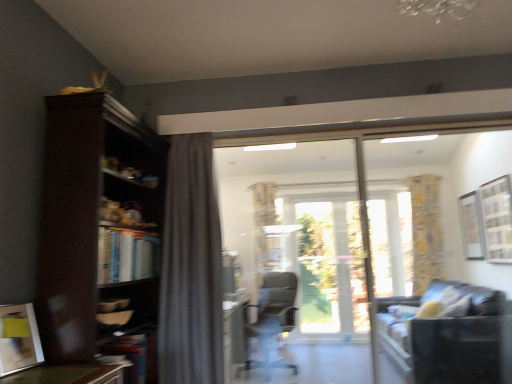
Measure the distance between transparent glass screen door at center and camera.

transparent glass screen door at center and camera are 4.26 meters apart.

The image size is (512, 384). What are the coordinates of `yellow floral fabric curtain at right, which is the 2th curtain in left-to-right order` in the screenshot? It's located at (426, 231).

Identify the location of transparent glass door at center. Image resolution: width=512 pixels, height=384 pixels. (326, 262).

Measure the distance between dark gray textured curtain at center, which appears as the 2th curtain when viewed from the back, and camera.

The depth of dark gray textured curtain at center, which appears as the 2th curtain when viewed from the back, is 2.48 meters.

This screenshot has width=512, height=384. What do you see at coordinates (497, 219) in the screenshot?
I see `clear glass window at upper right` at bounding box center [497, 219].

The image size is (512, 384). Identify the location of transparent glass screen door at center. (295, 261).

Is matte gray office chair at center not near hardcover books at left?

Indeed, matte gray office chair at center is not near hardcover books at left.

Is matte gray office chair at center in front of hardcover books at left?

No, matte gray office chair at center is further to the viewer.

From a real-world perspective, does matte gray office chair at center stand above hardcover books at left?

Incorrect, from a real-world perspective, matte gray office chair at center is lower than hardcover books at left.

Is transparent glass screen door at center facing towards matte yellow picture frame at lower left, which is counted as the second picture frame, starting from the right?

No, transparent glass screen door at center is not oriented towards matte yellow picture frame at lower left, which is counted as the second picture frame, starting from the right.

You are a GUI agent. You are given a task and a screenshot of the screen. Output one action in this format:
    pyautogui.click(x=<x>, y=<y>)
    Task: Click on the screen door on the right of matte yellow picture frame at lower left, which is counted as the second picture frame, starting from the right
    
    Given the screenshot: What is the action you would take?
    pyautogui.click(x=295, y=261)

How far apart are transparent glass screen door at center and matte yellow picture frame at lower left, the first picture frame when ordered from left to right?

transparent glass screen door at center is 4.38 meters from matte yellow picture frame at lower left, the first picture frame when ordered from left to right.

Are transparent glass screen door at center and matte yellow picture frame at lower left, which is counted as the second picture frame, starting from the right, far apart?

Absolutely, transparent glass screen door at center is distant from matte yellow picture frame at lower left, which is counted as the second picture frame, starting from the right.

Are matte gray office chair at center and dark wood bookcase at left located far from each other?

Yes, matte gray office chair at center is far from dark wood bookcase at left.

Consider the image. How different are the orientations of matte gray office chair at center and dark wood bookcase at left in degrees?

There is a 114-degree angle between the facing directions of matte gray office chair at center and dark wood bookcase at left.

Choose the correct answer: Is matte gray office chair at center inside dark wood bookcase at left or outside it?

matte gray office chair at center is located beyond the bounds of dark wood bookcase at left.

Is matte gray office chair at center bigger than dark wood bookcase at left?

Incorrect, matte gray office chair at center is not larger than dark wood bookcase at left.

Can you confirm if clear glass window at upper right is bigger than transparent glass door at center?

No.

Is clear glass window at upper right far away from transparent glass door at center?

clear glass window at upper right is far away from transparent glass door at center.

Which point is more forward, (482,221) or (313,327)?

The point (482,221) is more forward.

From the image's perspective, is clear glass window at upper right above or below transparent glass door at center?

From the image's perspective, clear glass window at upper right appears above transparent glass door at center.

From a real-world perspective, which object rests below the other?

dark gray fabric couch at lower right is physically lower.

Between dark gray fabric couch at lower right and matte gray office chair at center, which one is positioned in front?

dark gray fabric couch at lower right is more forward.

Does dark gray fabric couch at lower right appear on the left side of matte gray office chair at center?

Incorrect, dark gray fabric couch at lower right is not on the left side of matte gray office chair at center.

Is point (393, 304) in front of point (249, 365)?

Yes, point (393, 304) is closer to viewer.

Is clear glass window at upper right completely or partially inside hardcover books at left?

No.

Considering the relative sizes of hardcover books at left and clear glass window at upper right in the image provided, is hardcover books at left taller than clear glass window at upper right?

No.

Is hardcover books at left oriented away from clear glass window at upper right?

That's not correct — hardcover books at left is not looking away from clear glass window at upper right.

The image size is (512, 384). I want to click on window above the hardcover books at left (from the image's perspective), so coord(497,219).

Which point is more forward, (x=22, y=357) or (x=212, y=172)?

The point (x=22, y=357) is closer to the camera.

Can you tell me how much matte yellow picture frame at lower left, the first picture frame when ordered from left to right, and dark gray textured curtain at center, which appears as the 2th curtain when viewed from the back, differ in facing direction?

The facing directions of matte yellow picture frame at lower left, the first picture frame when ordered from left to right, and dark gray textured curtain at center, which appears as the 2th curtain when viewed from the back, are 80.6 degrees apart.

Do you think matte yellow picture frame at lower left, which is counted as the second picture frame, starting from the right, is within dark gray textured curtain at center, the second curtain when ordered from right to left, or outside of it?

matte yellow picture frame at lower left, which is counted as the second picture frame, starting from the right, is outside dark gray textured curtain at center, the second curtain when ordered from right to left.

Which object is positioned more to the right, matte yellow picture frame at lower left, which is counted as the second picture frame, starting from the right, or dark gray textured curtain at center, which is the 1th curtain in front-to-back order?

dark gray textured curtain at center, which is the 1th curtain in front-to-back order.

At what (x,y) coordinates should I click in order to perform the action: click on book in front of the matte gray office chair at center. Please return your answer as a coordinate pair (x, y). This screenshot has width=512, height=384. Looking at the image, I should click on (126, 255).

Locate an element on the screen. This screenshot has height=384, width=512. screen door on the right of matte yellow picture frame at lower left, which is counted as the second picture frame, starting from the right is located at coordinates (295, 261).

Consider the image. Which object lies nearer to the anchor point dark gray textured curtain at center, which is the 1th curtain in front-to-back order, transparent glass door at center or yellow floral fabric curtain at right, which is the 2th curtain in left-to-right order?

transparent glass door at center lies closer to dark gray textured curtain at center, which is the 1th curtain in front-to-back order, than the other object.

Based on their spatial positions, is dark gray textured curtain at center, the first curtain from the left, or matte gray office chair at center closer to transparent glass screen door at center?

The object closer to transparent glass screen door at center is matte gray office chair at center.

Which object lies further to the anchor point white matte picture frame at upper right, acting as the second picture frame starting from the left, dark wood bookcase at left or yellow floral fabric curtain at right, the first curtain from the right?

dark wood bookcase at left is positioned further to the anchor white matte picture frame at upper right, acting as the second picture frame starting from the left.

Looking at the image, which one is located closer to clear glass window at upper right, matte gray office chair at center or hardcover books at left?

Among the two, matte gray office chair at center is located nearer to clear glass window at upper right.

Based on their spatial positions, is matte gray office chair at center or matte yellow picture frame at lower left, the second picture frame from the back, further from dark gray textured curtain at center, the first curtain from the left?

matte gray office chair at center is positioned further to the anchor dark gray textured curtain at center, the first curtain from the left.

Looking at the image, which one is located further to yellow floral fabric curtain at right, the first curtain from the right, hardcover books at left or transparent glass screen door at center?

hardcover books at left is further to yellow floral fabric curtain at right, the first curtain from the right.

Based on their spatial positions, is dark wood bookcase at left or matte yellow picture frame at lower left, the first picture frame when ordered from left to right, further from yellow floral fabric curtain at right, which is the 2th curtain in left-to-right order?

matte yellow picture frame at lower left, the first picture frame when ordered from left to right, is further to yellow floral fabric curtain at right, which is the 2th curtain in left-to-right order.

From the image, which object appears to be farther from matte yellow picture frame at lower left, which is counted as the second picture frame, starting from the right, dark wood bookcase at left or transparent glass screen door at center?

Among the two, transparent glass screen door at center is located further to matte yellow picture frame at lower left, which is counted as the second picture frame, starting from the right.

Find the location of a particular element. Image resolution: width=512 pixels, height=384 pixels. chair between dark wood bookcase at left and white matte picture frame at upper right, acting as the second picture frame starting from the left, from left to right is located at coordinates (271, 321).

Identify the location of curtain located between dark wood bookcase at left and matte gray office chair at center in the depth direction. This screenshot has width=512, height=384. (191, 267).

The image size is (512, 384). In order to click on curtain between matte yellow picture frame at lower left, which appears as the first picture frame when viewed from the front, and dark gray fabric couch at lower right in this screenshot , I will do tap(191, 267).

Locate an element on the screen. Image resolution: width=512 pixels, height=384 pixels. screen door between matte gray office chair at center and white matte picture frame at upper right, arranged as the first picture frame when viewed from the right, from left to right is located at coordinates (295, 261).